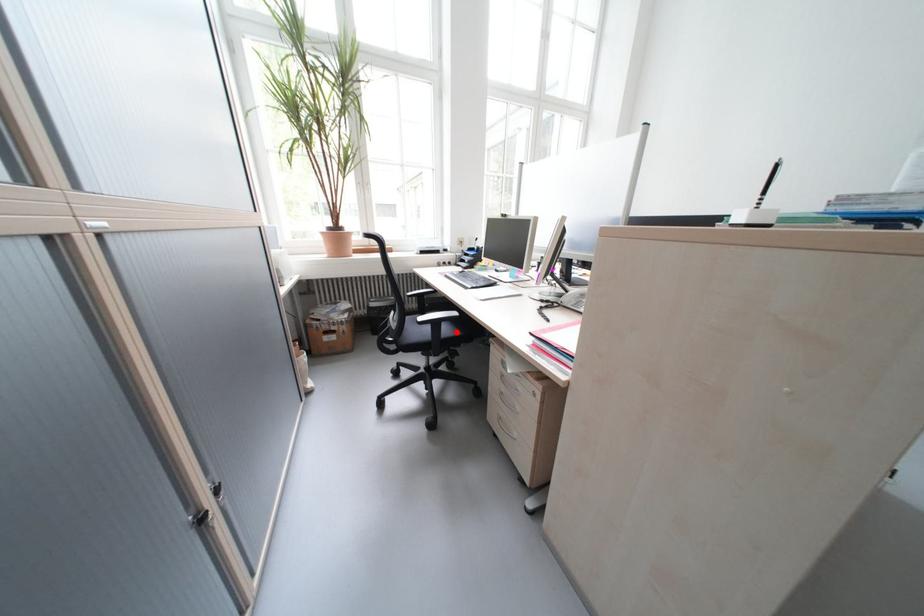
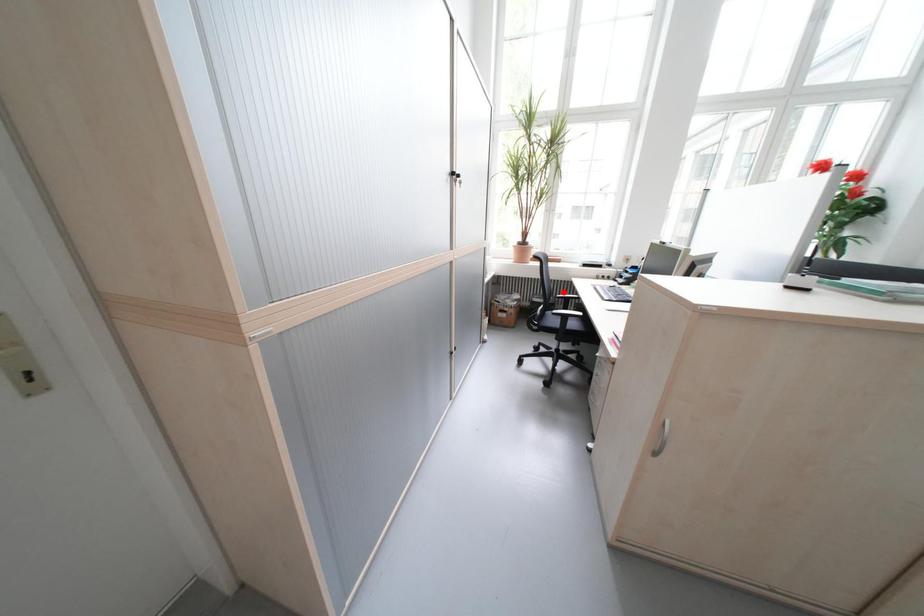
I am providing you with two images of the same scene from different viewpoints. A red point is marked on the first image and another point is marked on the second image. Does the point marked in image1 correspond to the same location as the one in image2?

No